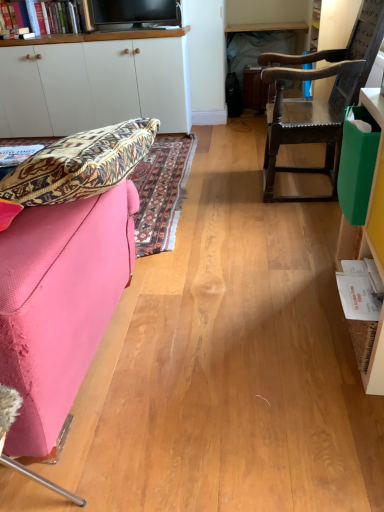
What are the coordinates of `vacant area that lies between dark brown wooden chair at right and green plastic bag at right, which ranks as the first cabinetry in bottom-to-top order` in the screenshot? It's located at (306, 237).